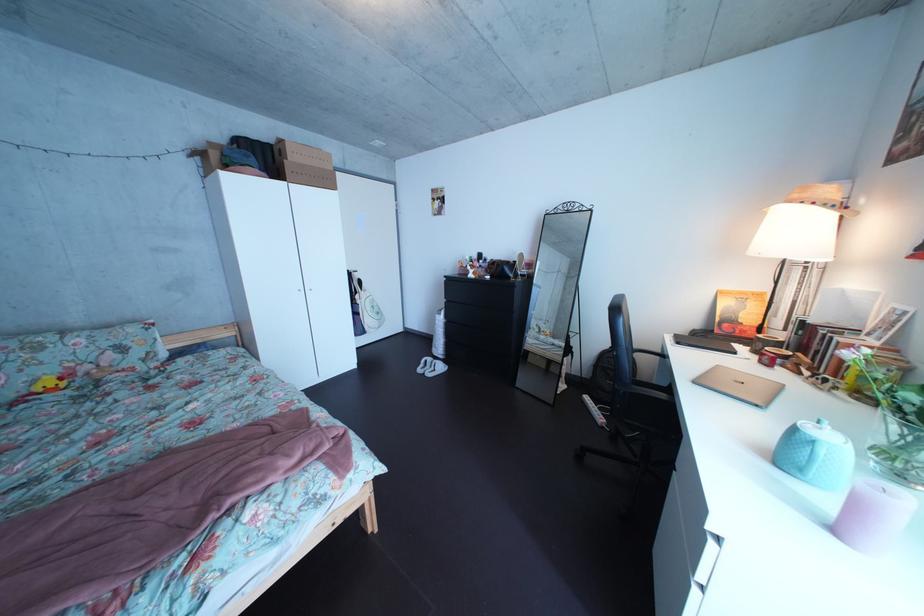
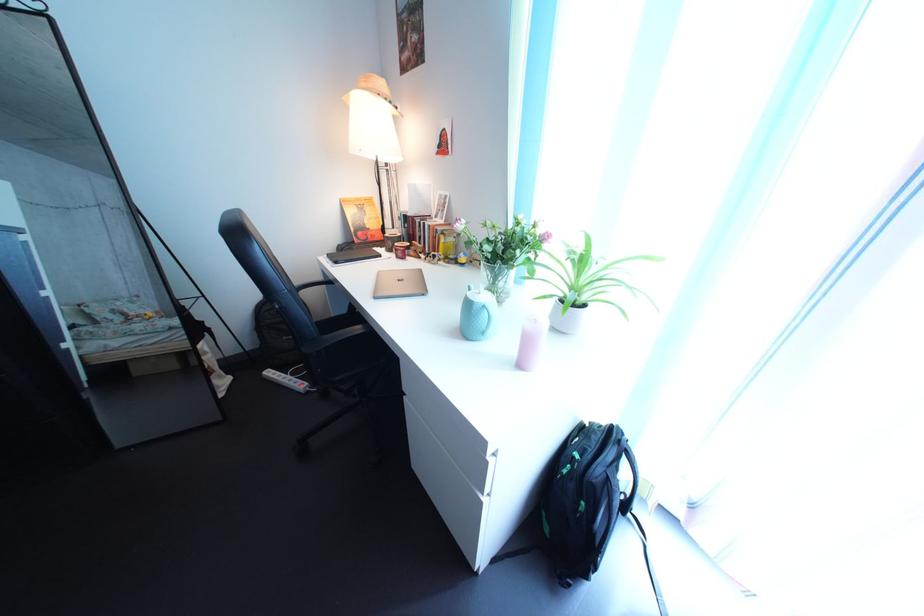
Where in the second image is the point corresponding to point 621,353 from the first image?

(272, 305)